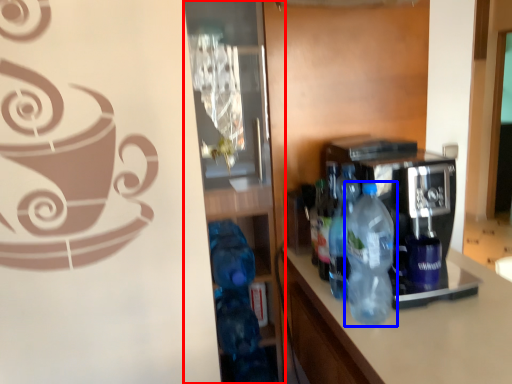
Question: Which object is further to the camera taking this photo, glass door (highlighted by a red box) or bottle (highlighted by a blue box)?

Choices:
 (A) glass door
 (B) bottle

Answer: (A)